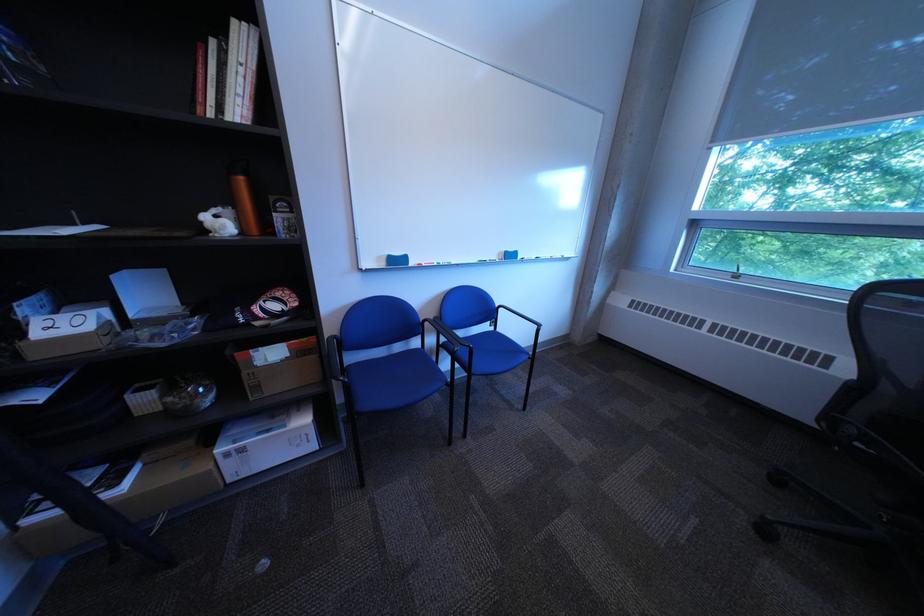
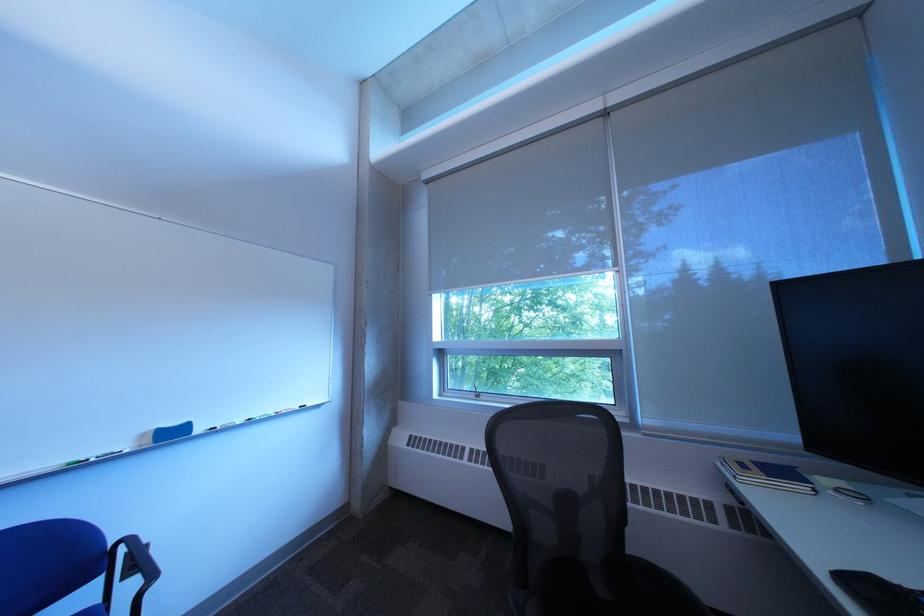
In the second image, find the point that corresponds to (x=535, y=259) in the first image.

(213, 432)